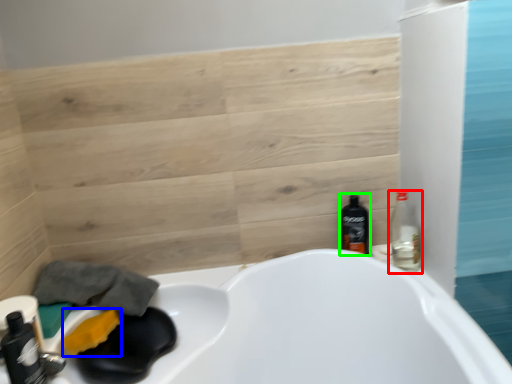
Question: Estimate the real-world distances between objects in this image. Which object is closer to bottle (highlighted by a red box), soap (highlighted by a blue box) or bottle (highlighted by a green box)?

Choices:
 (A) soap
 (B) bottle

Answer: (B)